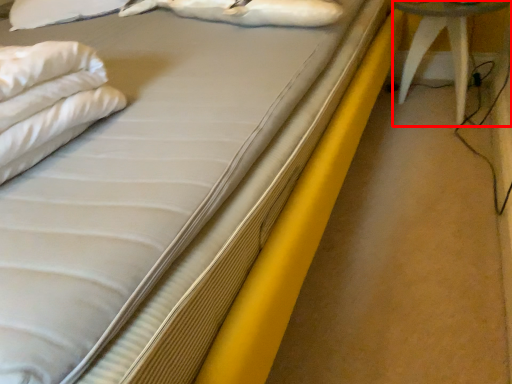
Question: From the image's perspective, where is furniture (annotated by the red box) located relative to animal?

Choices:
 (A) below
 (B) above

Answer: (A)